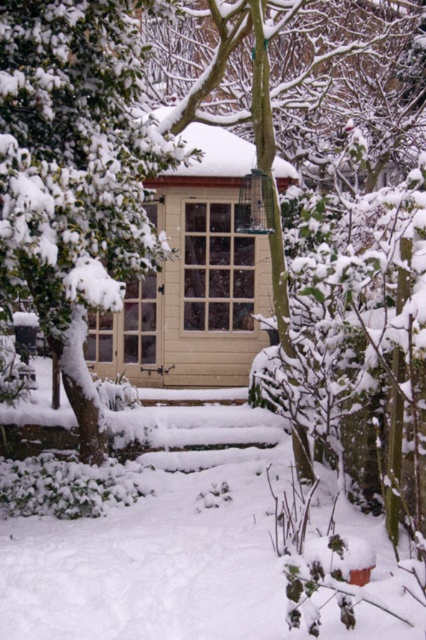
Question: From the image, what is the correct spatial relationship of green textured tree at left in relation to wooden window at center?

Choices:
 (A) right
 (B) left

Answer: (B)

Question: Considering the relative positions of green textured tree at left and wooden window at center in the image provided, where is green textured tree at left located with respect to wooden window at center?

Choices:
 (A) left
 (B) right

Answer: (A)

Question: Among these points, which one is farthest from the camera?

Choices:
 (A) (233, 228)
 (B) (77, 280)

Answer: (A)

Question: Which of the following is the closest to the observer?

Choices:
 (A) wooden window at center
 (B) green textured tree at left

Answer: (B)

Question: Where is green textured tree at left located in relation to wooden window at center in the image?

Choices:
 (A) left
 (B) right

Answer: (A)

Question: Which point is closer to the camera?

Choices:
 (A) (34, 10)
 (B) (199, 273)

Answer: (A)